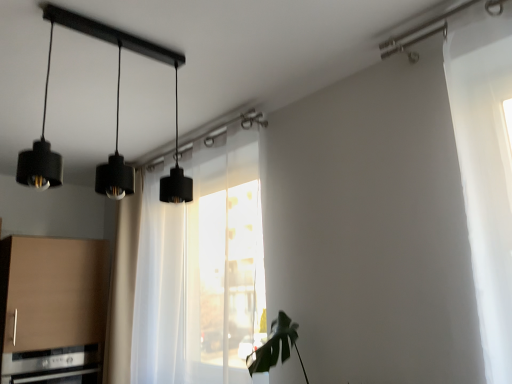
You are a GUI agent. You are given a task and a screenshot of the screen. Output one action in this format:
    pyautogui.click(x=<x>, y=<y>)
    Task: Click on the satin silver oven at lower left
    
    Given the screenshot: What is the action you would take?
    coord(52,366)

Locate an element on the screen. transparent fabric at center is located at coordinates (201, 268).

In order to click on matte black pendant light at upper left in this screenshot , I will do `click(116, 120)`.

Locate an element on the screen. satin silver oven at lower left is located at coordinates (52, 366).

Is point (76, 354) closer to viewer compared to point (41, 348)?

No, it is not.

Is satin silver oven at lower left facing towards matte brown cabinet at lower left?

No.

Are satin silver oven at lower left and matte brown cabinet at lower left far apart?

That's not correct — satin silver oven at lower left is a little close to matte brown cabinet at lower left.

Can we say satin silver oven at lower left lies outside matte brown cabinet at lower left?

satin silver oven at lower left lies outside matte brown cabinet at lower left's area.

Could you tell me if satin silver oven at lower left is facing matte black pendant light at upper left?

No, satin silver oven at lower left is not facing towards matte black pendant light at upper left.

Considering the relative sizes of satin silver oven at lower left and matte black pendant light at upper left in the image provided, is satin silver oven at lower left taller than matte black pendant light at upper left?

Incorrect, the height of satin silver oven at lower left is not larger of that of matte black pendant light at upper left.

How many degrees apart are the facing directions of satin silver oven at lower left and matte black pendant light at upper left?

90.2 degrees.

Consider the image. From a real-world perspective, is satin silver oven at lower left on matte black pendant light at upper left?

Actually, satin silver oven at lower left is physically below matte black pendant light at upper left in the real world.

How much distance is there between satin silver oven at lower left and transparent fabric at center?

satin silver oven at lower left is 31.95 inches away from transparent fabric at center.

Which object is positioned more to the right, satin silver oven at lower left or transparent fabric at center?

Positioned to the right is transparent fabric at center.

From a real-world perspective, is satin silver oven at lower left located higher than transparent fabric at center?

Actually, satin silver oven at lower left is physically below transparent fabric at center in the real world.

Considering the sizes of satin silver oven at lower left and transparent fabric at center in the image, is satin silver oven at lower left bigger or smaller than transparent fabric at center?

Clearly, satin silver oven at lower left is smaller in size than transparent fabric at center.

Does matte black pendant light at upper left have a greater width compared to satin silver oven at lower left?

Incorrect, the width of matte black pendant light at upper left does not surpass that of satin silver oven at lower left.

In the scene shown: Which object is positioned more to the left, matte black pendant light at upper left or satin silver oven at lower left?

Positioned to the left is satin silver oven at lower left.

Does matte black pendant light at upper left have a lesser height compared to satin silver oven at lower left?

No, matte black pendant light at upper left is not shorter than satin silver oven at lower left.

In the scene shown: Are matte black pendant light at upper left and satin silver oven at lower left located far from each other?

Yes, matte black pendant light at upper left and satin silver oven at lower left are located far from each other.

Who is taller, matte brown cabinet at lower left or transparent fabric at center?

Standing taller between the two is transparent fabric at center.

Which object is positioned more to the right, matte brown cabinet at lower left or transparent fabric at center?

transparent fabric at center is more to the right.

Measure the distance from matte brown cabinet at lower left to transparent fabric at center.

matte brown cabinet at lower left and transparent fabric at center are 24.79 inches apart from each other.

At what (x,y) coordinates should I click in order to perform the action: click on window above the matte brown cabinet at lower left (from the image's perspective). Please return your answer as a coordinate pair (x, y). Looking at the image, I should click on (201, 268).

Can you confirm if matte brown cabinet at lower left is wider than matte black pendant light at upper left?

Yes.

From their relative heights in the image, would you say matte brown cabinet at lower left is taller or shorter than matte black pendant light at upper left?

Considering their sizes, matte brown cabinet at lower left has more height than matte black pendant light at upper left.

From the image's perspective, is matte brown cabinet at lower left under matte black pendant light at upper left?

Correct, matte brown cabinet at lower left appears lower than matte black pendant light at upper left in the image.

Considering the sizes of matte brown cabinet at lower left and matte black pendant light at upper left in the image, is matte brown cabinet at lower left bigger or smaller than matte black pendant light at upper left?

matte brown cabinet at lower left is bigger than matte black pendant light at upper left.

Can you tell me how much matte black pendant light at upper left and matte brown cabinet at lower left differ in facing direction?

The angle between the facing direction of matte black pendant light at upper left and the facing direction of matte brown cabinet at lower left is 90.2 degrees.

From the picture: How distant is matte black pendant light at upper left from matte brown cabinet at lower left?

matte black pendant light at upper left is 32.44 inches from matte brown cabinet at lower left.

Between matte black pendant light at upper left and matte brown cabinet at lower left, which one appears on the right side from the viewer's perspective?

matte black pendant light at upper left is more to the right.

Could you tell me if matte black pendant light at upper left is turned towards matte brown cabinet at lower left?

No, matte black pendant light at upper left is not oriented towards matte brown cabinet at lower left.

What are the coordinates of `cabinetry behind the satin silver oven at lower left` in the screenshot? It's located at (51, 292).

At what (x,y) coordinates should I click in order to perform the action: click on lamp located in front of the satin silver oven at lower left. Please return your answer as a coordinate pair (x, y). This screenshot has width=512, height=384. Looking at the image, I should click on (116, 120).

Which object lies further to the anchor point transparent fabric at center, matte brown cabinet at lower left or satin silver oven at lower left?

satin silver oven at lower left is further to transparent fabric at center.

From the image, which object appears to be nearer to matte brown cabinet at lower left, satin silver oven at lower left or transparent fabric at center?

satin silver oven at lower left.

When comparing their distances from transparent fabric at center, does matte black pendant light at upper left or satin silver oven at lower left seem further?

Based on the image, satin silver oven at lower left appears to be further to transparent fabric at center.

From the image, which object appears to be farther from satin silver oven at lower left, transparent fabric at center or matte brown cabinet at lower left?

transparent fabric at center.

Looking at the image, which one is located further to matte brown cabinet at lower left, transparent fabric at center or satin silver oven at lower left?

transparent fabric at center is positioned further to the anchor matte brown cabinet at lower left.

When comparing their distances from matte black pendant light at upper left, does transparent fabric at center or satin silver oven at lower left seem closer?

transparent fabric at center lies closer to matte black pendant light at upper left than the other object.

When comparing their distances from transparent fabric at center, does matte brown cabinet at lower left or matte black pendant light at upper left seem further?

Based on the image, matte black pendant light at upper left appears to be further to transparent fabric at center.

Which object lies nearer to the anchor point transparent fabric at center, satin silver oven at lower left or matte black pendant light at upper left?

matte black pendant light at upper left is closer to transparent fabric at center.

Find the location of `window between matte black pendant light at upper left and satin silver oven at lower left in the up-down direction`. window between matte black pendant light at upper left and satin silver oven at lower left in the up-down direction is located at coordinates (201, 268).

What are the coordinates of `window between matte black pendant light at upper left and matte brown cabinet at lower left from front to back` in the screenshot? It's located at (201, 268).

At what (x,y) coordinates should I click in order to perform the action: click on cabinetry between matte black pendant light at upper left and satin silver oven at lower left in the up-down direction. Please return your answer as a coordinate pair (x, y). The width and height of the screenshot is (512, 384). Looking at the image, I should click on (51, 292).

Where is `appliance located between matte brown cabinet at lower left and transparent fabric at center in the left-right direction`? This screenshot has width=512, height=384. appliance located between matte brown cabinet at lower left and transparent fabric at center in the left-right direction is located at coordinates (52, 366).